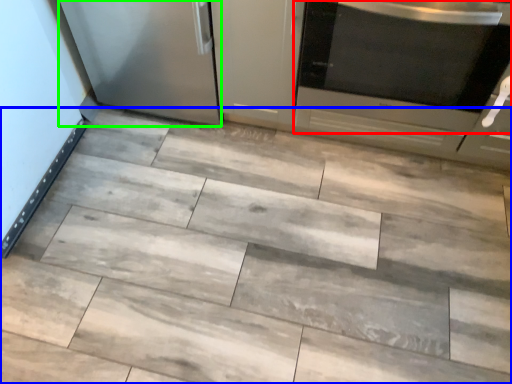
Question: Based on their relative distances, which object is nearer to home appliance (highlighted by a red box)? Choose from ceramic tile (highlighted by a blue box) and appliance (highlighted by a green box).

Choices:
 (A) ceramic tile
 (B) appliance

Answer: (A)